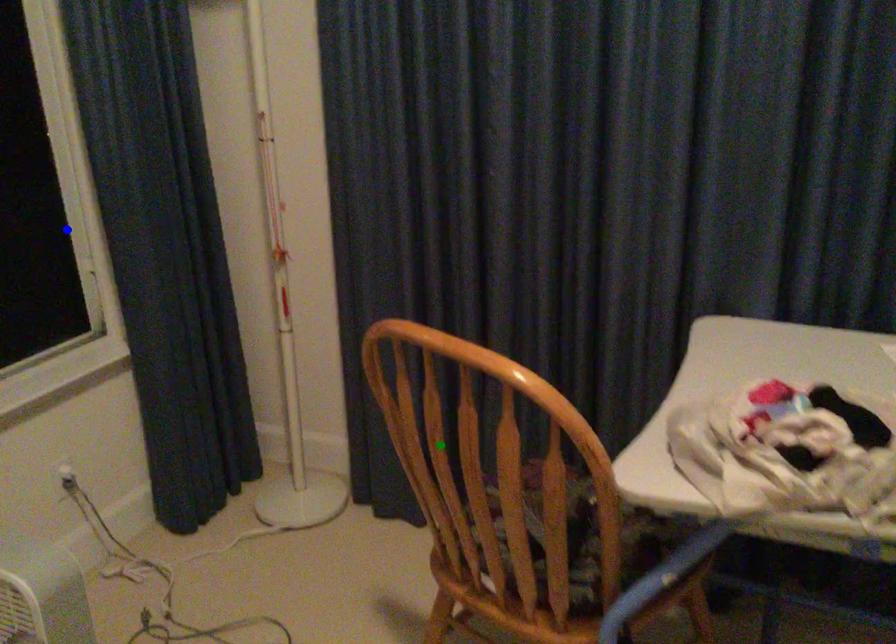
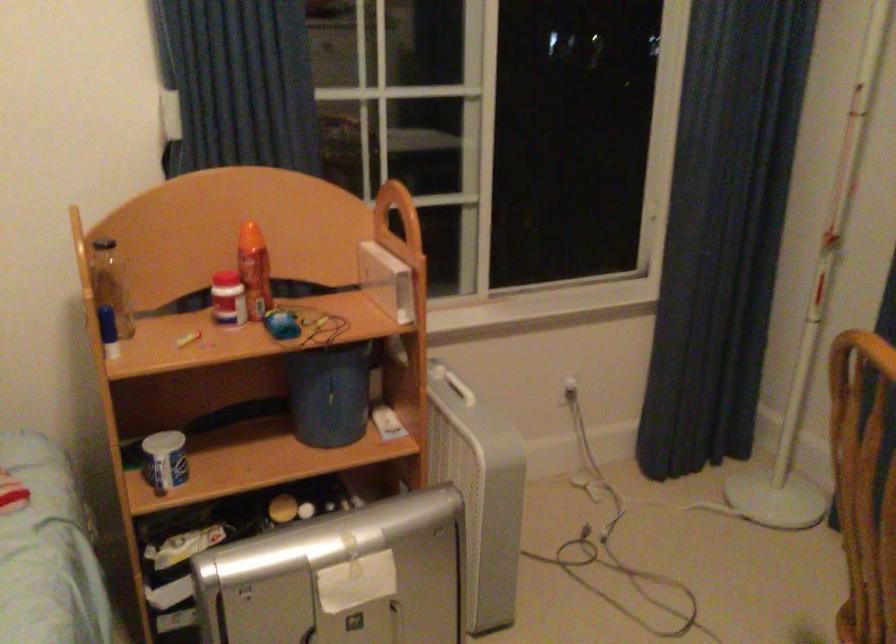
I am providing you with two images of the same scene from different viewpoints. Three points are marked in image1. Which point corresponds to a part or object that is occluded in image2?In image1, three points are marked. Which of them correspond to a part or object that is occluded in image2?Among the three points shown in image1, which one corresponds to a part or object that is no longer visible due to occlusion in image2?

Invisible in image2: blue point.